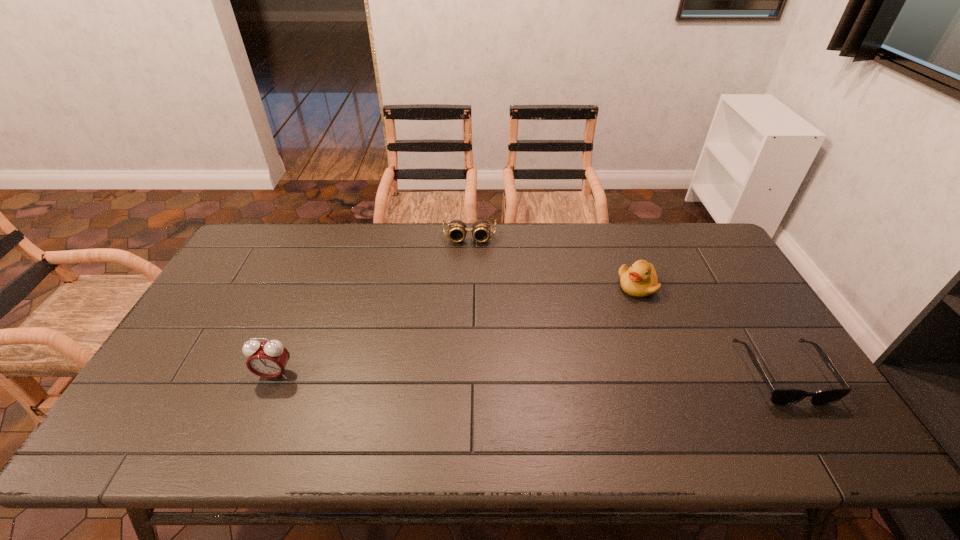
The image size is (960, 540). I want to click on free space at the near edge, so click(x=629, y=386).

Where is `vacant space at the left edge`? This screenshot has height=540, width=960. vacant space at the left edge is located at coordinates (183, 350).

Where is `vacant point at the right edge`? The height and width of the screenshot is (540, 960). vacant point at the right edge is located at coordinates (757, 328).

Identify the location of free space at the far left corner. (276, 222).

The width and height of the screenshot is (960, 540). What are the coordinates of `vacant area that lies between the leftmost object and the third shortest object` in the screenshot? It's located at (456, 330).

This screenshot has width=960, height=540. Identify the location of vacant space that's between the rightmost object and the goggles. (626, 306).

You are a GUI agent. You are given a task and a screenshot of the screen. Output one action in this format:
    pyautogui.click(x=<x>, y=<y>)
    Task: Click on the free space between the alarm clock and the second object from right to left
    The width and height of the screenshot is (960, 540).
    Given the screenshot: What is the action you would take?
    pyautogui.click(x=456, y=330)

Identify the location of empty location between the farthest object and the third object from left to right. This screenshot has width=960, height=540. (554, 262).

Locate an element on the screen. This screenshot has height=540, width=960. empty space between the second object from right to left and the shortest object is located at coordinates (709, 330).

At what (x,y) coordinates should I click in order to perform the action: click on free point between the second farthest object and the leftmost object. Please return your answer as a coordinate pair (x, y). The height and width of the screenshot is (540, 960). Looking at the image, I should click on (456, 330).